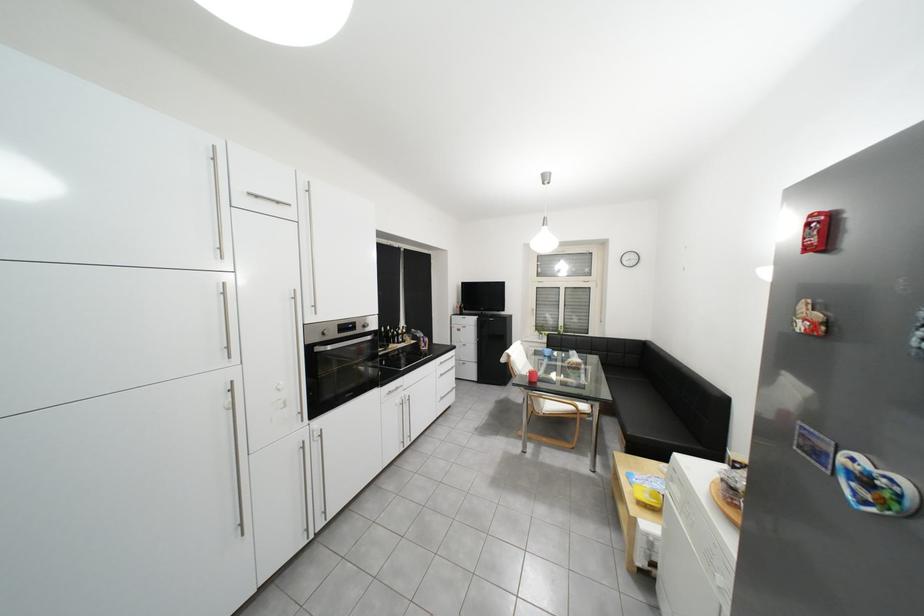
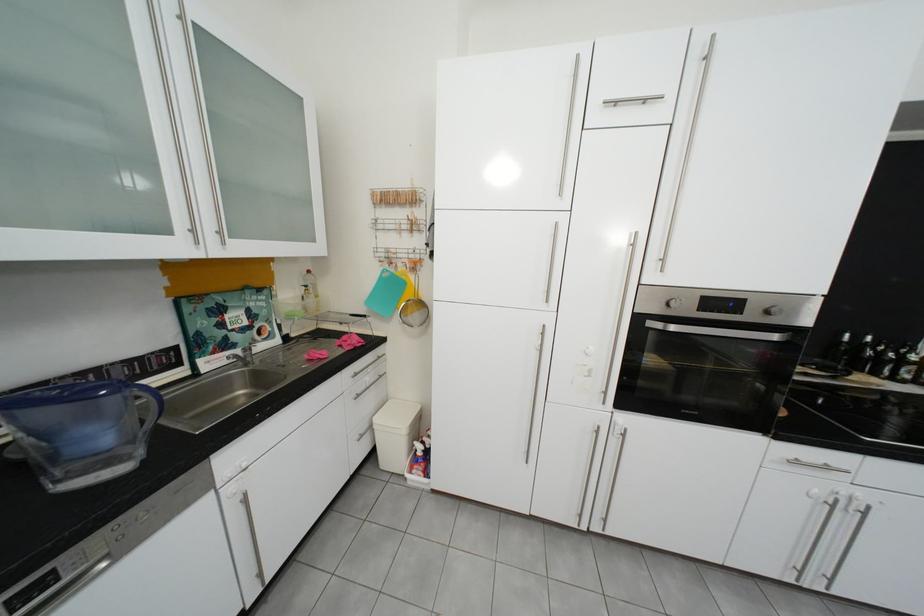
Question: The camera is either moving clockwise (left) or counter-clockwise (right) around the object. The first image is from the beginning of the video and the second image is from the end. Is the camera moving left or right when shooting the video?

Choices:
 (A) Left
 (B) Right

Answer: (B)